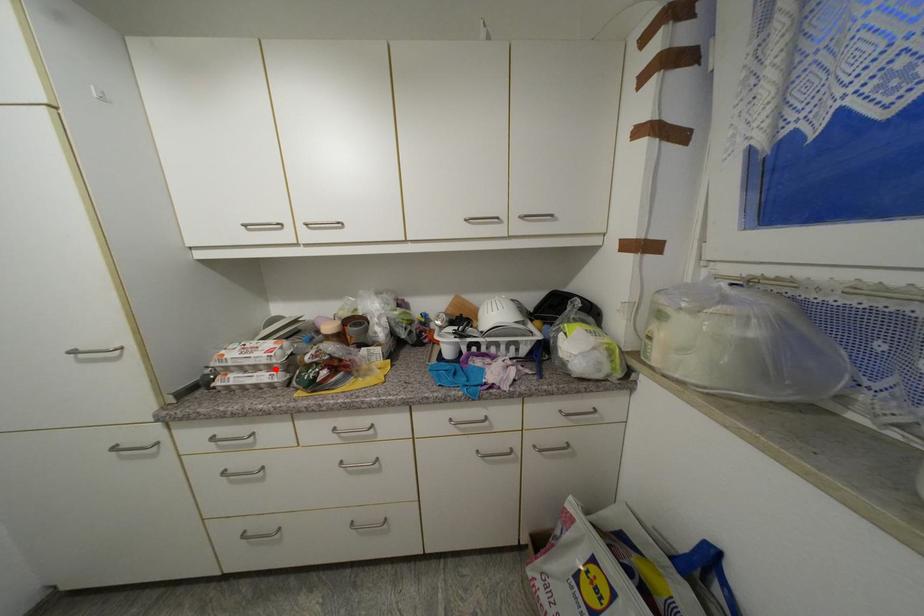
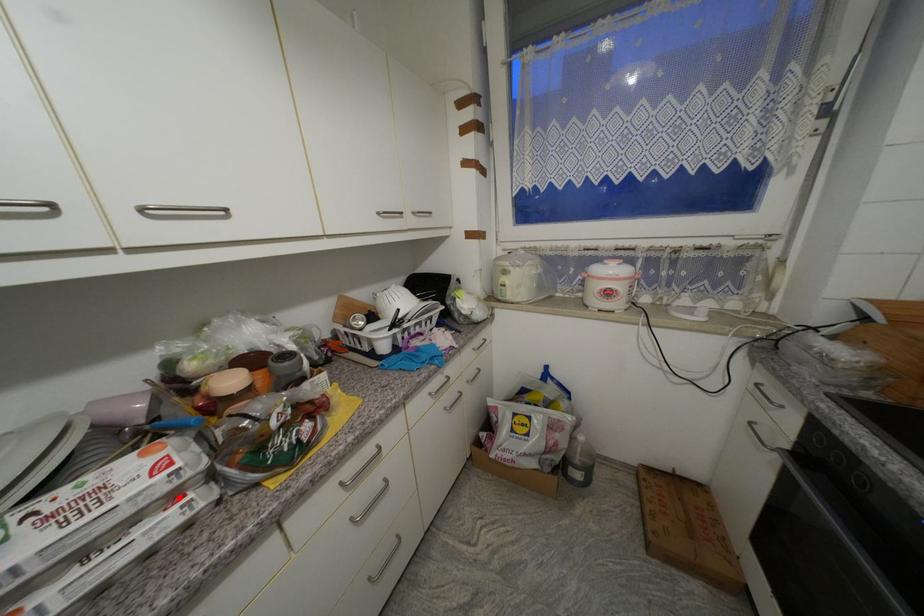
I am providing you with two images of the same scene from different viewpoints. A red point is marked on the first image and another point is marked on the second image. Is the red point in image1 aligned with the point shown in image2?

Yes